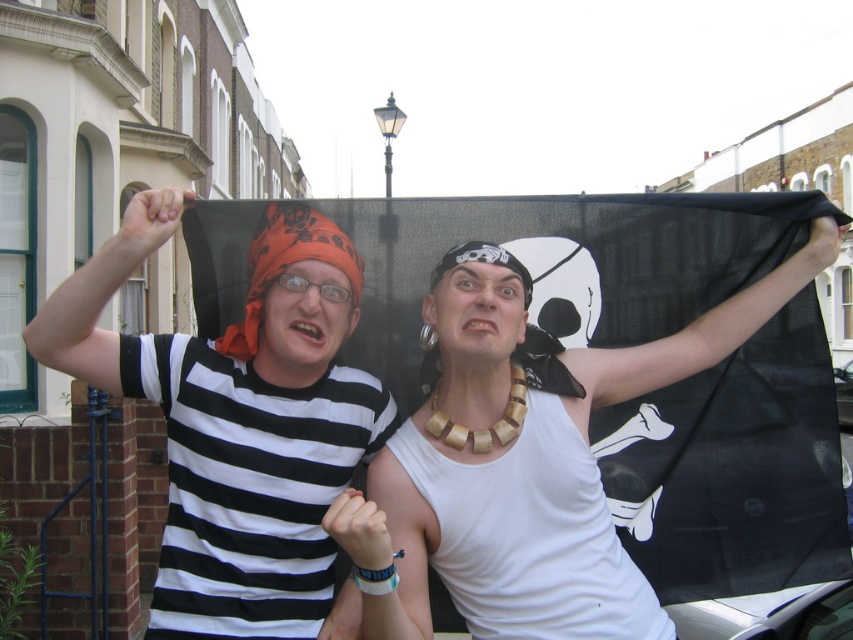
Question: Does matte black flag at center appear under matte black bandana at left?

Choices:
 (A) no
 (B) yes

Answer: (A)

Question: Can you confirm if matte black flag at center is bigger than matte black bandana at left?

Choices:
 (A) no
 (B) yes

Answer: (B)

Question: Which point is closer to the camera taking this photo?

Choices:
 (A) click(294, 582)
 (B) click(187, 564)

Answer: (B)

Question: Which object is closer to the camera taking this photo?

Choices:
 (A) matte black flag at center
 (B) matte black bandana at left

Answer: (B)

Question: Is matte black flag at center below matte black bandana at left?

Choices:
 (A) yes
 (B) no

Answer: (B)